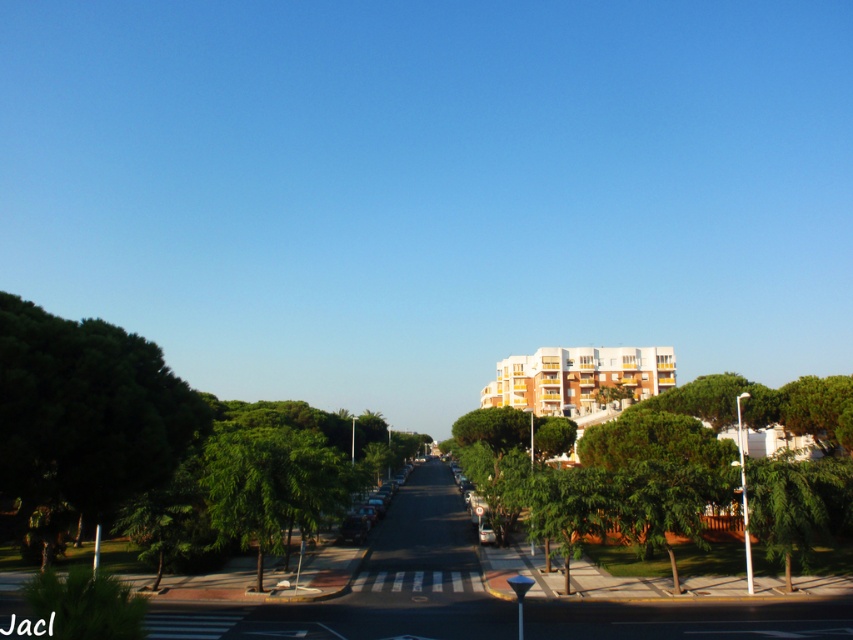
Question: Considering the real-world distances, which object is farthest from the green leafy tree at center?

Choices:
 (A) metallic silver car at center-right
 (B) green leafy tree at left

Answer: (B)

Question: Which point is closer to the camera?

Choices:
 (A) (601, 400)
 (B) (480, 518)

Answer: (B)

Question: Can you confirm if green leafy tree at center is wider than metallic silver car at center-right?

Choices:
 (A) no
 (B) yes

Answer: (B)

Question: Is green leafy tree at left to the left of green leafy tree at center from the viewer's perspective?

Choices:
 (A) yes
 (B) no

Answer: (A)

Question: Does green leafy tree at center have a smaller size compared to metallic silver car at center-right?

Choices:
 (A) no
 (B) yes

Answer: (A)

Question: Which object is closer to the camera taking this photo?

Choices:
 (A) metallic silver car at center-right
 (B) green leafy tree at center

Answer: (B)